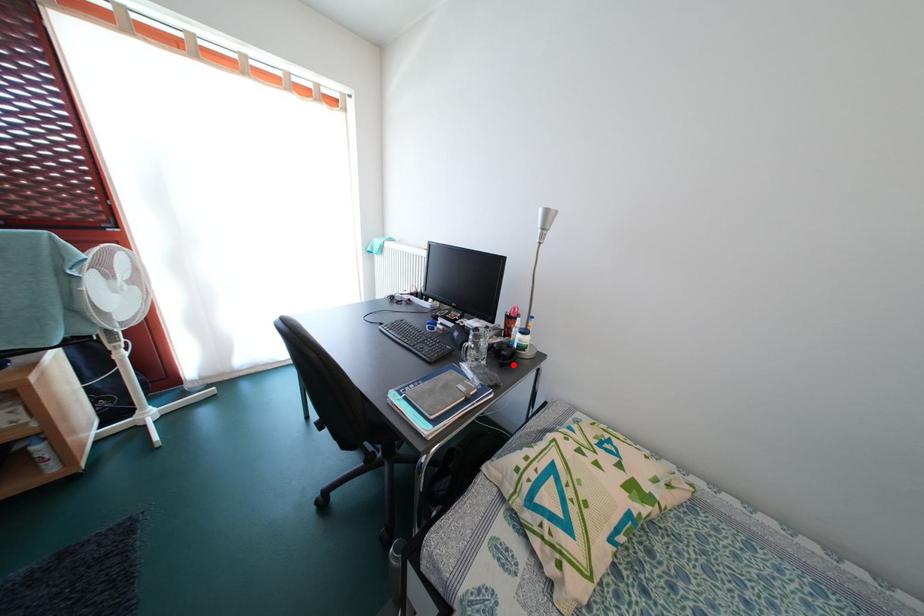
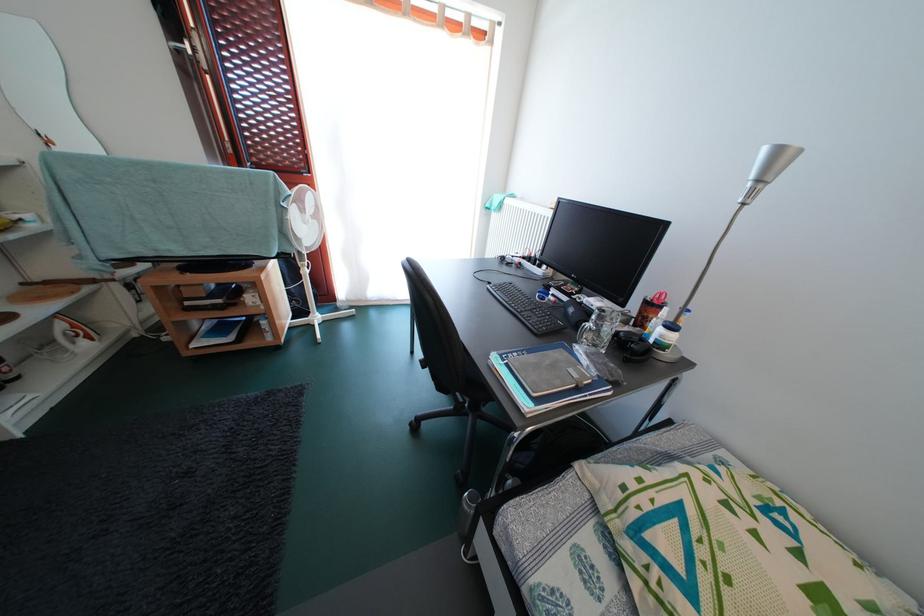
Where in the second image is the point corresponding to the highlighted location from the first image?

(640, 360)